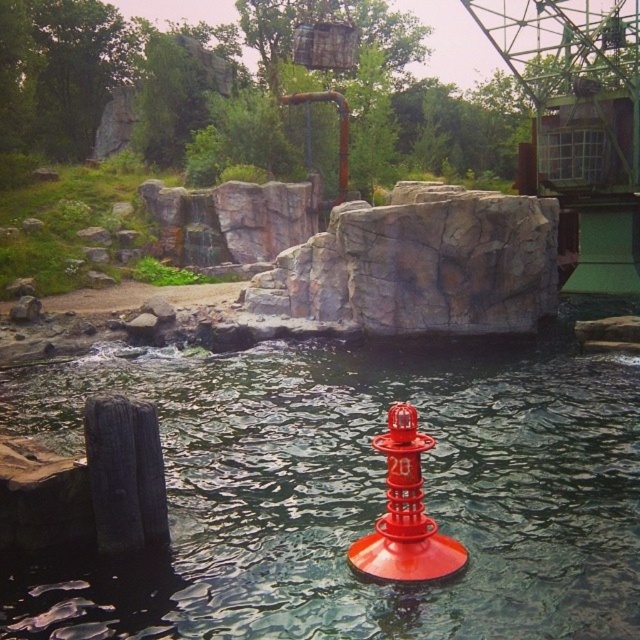
Question: Which point is closer to the camera taking this photo?

Choices:
 (A) (269, 392)
 (B) (420, 448)

Answer: (B)

Question: Does glossy plastic water at center lie behind red matte buoy at center?

Choices:
 (A) yes
 (B) no

Answer: (B)

Question: Does glossy plastic water at center appear on the right side of red matte buoy at center?

Choices:
 (A) yes
 (B) no

Answer: (A)

Question: Is glossy plastic water at center closer to the viewer compared to red matte buoy at center?

Choices:
 (A) no
 (B) yes

Answer: (B)